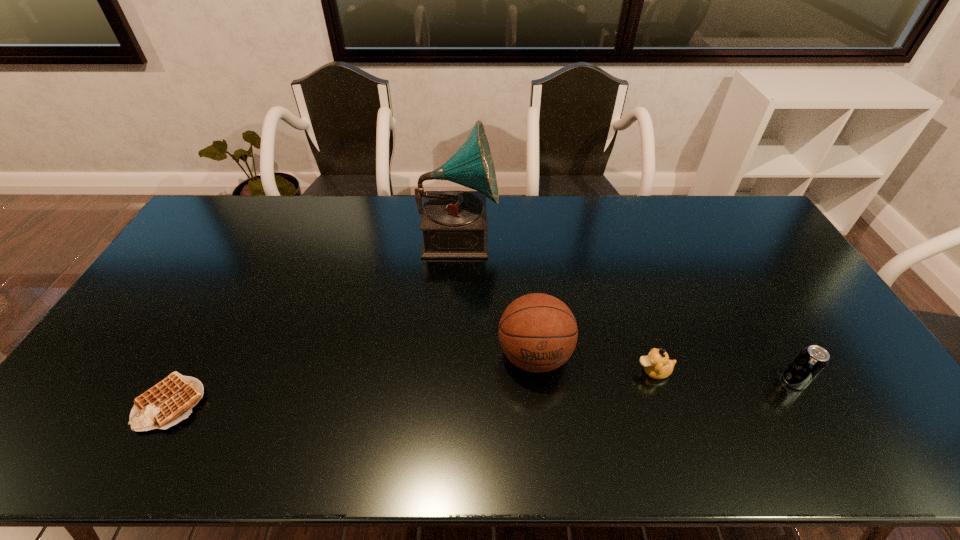
In the image, there is a desktop. At what (x,y) coordinates should I click in order to perform the action: click on vacant space at the right edge. Please return your answer as a coordinate pair (x, y). The height and width of the screenshot is (540, 960). Looking at the image, I should click on (892, 400).

Locate an element on the screen. This screenshot has width=960, height=540. vacant space at the far left corner of the desktop is located at coordinates (230, 222).

Where is `vacant space at the far right corner of the desktop`? This screenshot has width=960, height=540. vacant space at the far right corner of the desktop is located at coordinates (715, 203).

Locate an element on the screen. The image size is (960, 540). free space between the soda can and the duckling is located at coordinates (724, 376).

Identify the location of empty space that is in between the soda can and the duckling. This screenshot has width=960, height=540. (724, 376).

Where is `unoccupied position between the basketball and the record player`? The image size is (960, 540). unoccupied position between the basketball and the record player is located at coordinates (496, 295).

Where is `free spot between the second tallest object and the leftmost object`? free spot between the second tallest object and the leftmost object is located at coordinates (352, 379).

Where is `free space between the basketball and the shortest object`? free space between the basketball and the shortest object is located at coordinates (352, 379).

The height and width of the screenshot is (540, 960). In order to click on free space that is in between the farthest object and the waffle in this screenshot , I will do `click(315, 318)`.

Identify the location of free spot between the duckling and the shortest object. The height and width of the screenshot is (540, 960). (412, 387).